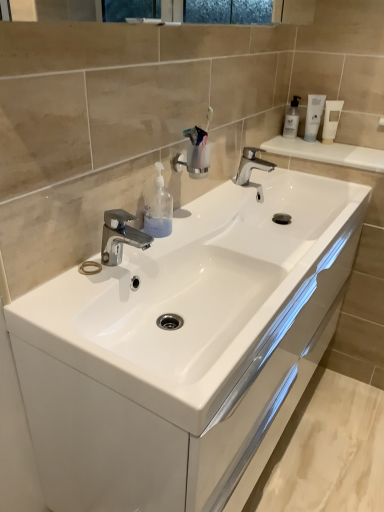
This screenshot has height=512, width=384. I want to click on vacant area that lies to the right of transparent plastic soap dispenser at center, so click(x=201, y=230).